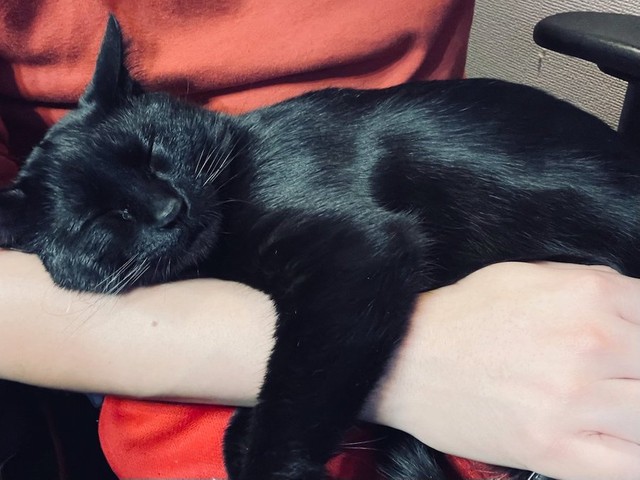
The height and width of the screenshot is (480, 640). Identify the location of black chair handle. (x=614, y=36).